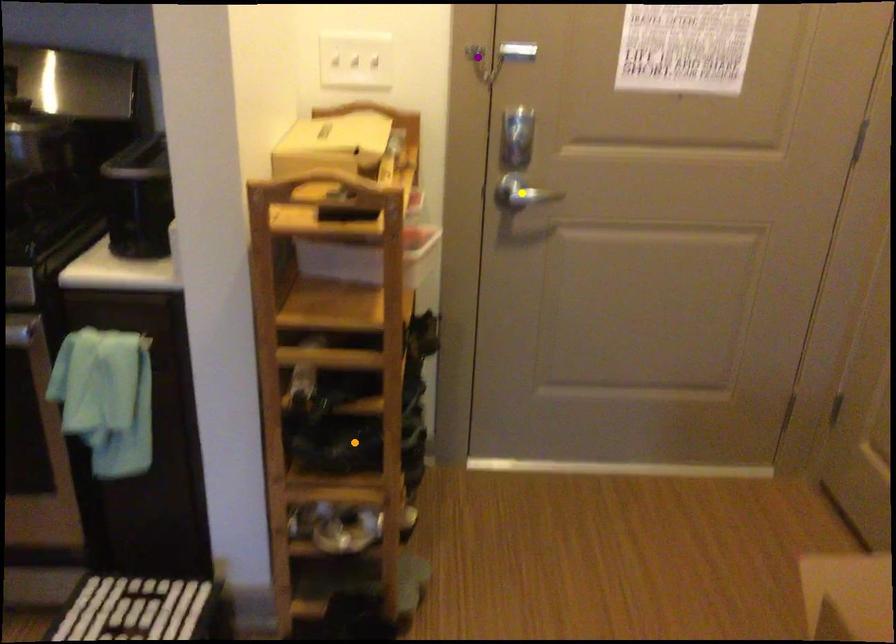
Order these from farthest to nearest:
A) yellow point
B) orange point
C) purple point

1. yellow point
2. purple point
3. orange point